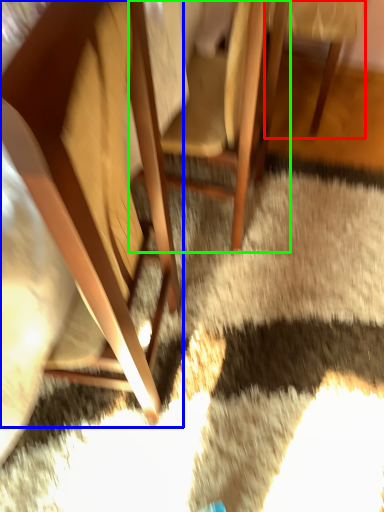
Question: Based on their relative distances, which object is nearer to chair (highlighted by a red box)? Choose from chair (highlighted by a blue box) and chair (highlighted by a green box).

Choices:
 (A) chair
 (B) chair

Answer: (B)